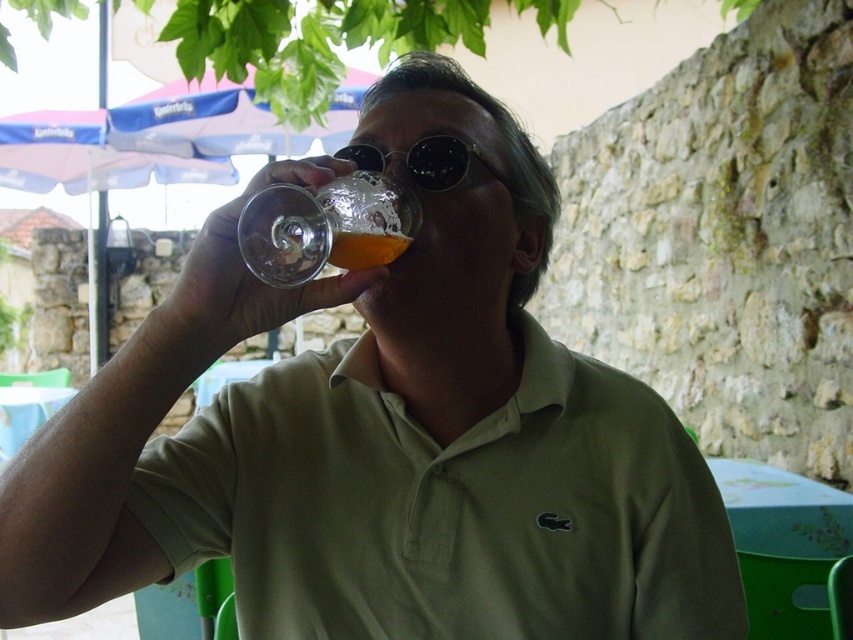
Which of these two, translucent glass at upper center or sunglasses at center, stands taller?

translucent glass at upper center

Is point (325, 216) positioned in front of point (469, 154)?

That is True.

You are a GUI agent. You are given a task and a screenshot of the screen. Output one action in this format:
    pyautogui.click(x=<x>, y=<y>)
    Task: Click on the translucent glass at upper center
    
    Given the screenshot: What is the action you would take?
    pyautogui.click(x=325, y=227)

Between green cotton polo shirt at center and sunglasses at center, which one is positioned higher?

Positioned higher is sunglasses at center.

Locate an element on the screen. The height and width of the screenshot is (640, 853). green cotton polo shirt at center is located at coordinates (447, 508).

Find the location of a particular element. This screenshot has height=640, width=853. green cotton polo shirt at center is located at coordinates (447, 508).

Between green cotton polo shirt at center and translucent glass at upper center, which one appears on the left side from the viewer's perspective?

translucent glass at upper center is more to the left.

Is point (444, 465) closer to viewer compared to point (263, 246)?

That is False.

At what (x,y) coordinates should I click in order to perform the action: click on green cotton polo shirt at center. Please return your answer as a coordinate pair (x, y). The image size is (853, 640). Looking at the image, I should click on (447, 508).